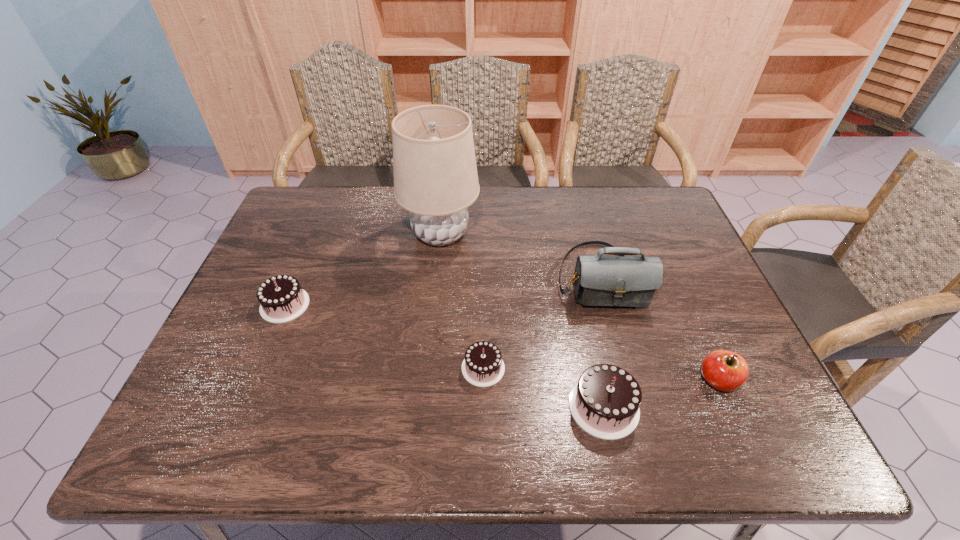
In the image, there is a desktop. Identify the location of blank space at the left edge. The height and width of the screenshot is (540, 960). (286, 272).

The image size is (960, 540). In order to click on free space at the right edge of the desktop in this screenshot , I will do `click(658, 241)`.

What are the coordinates of `blank space at the far left corner of the desktop` in the screenshot? It's located at (324, 220).

Where is `vacant space at the near left corner of the desktop`? The height and width of the screenshot is (540, 960). vacant space at the near left corner of the desktop is located at coordinates (203, 384).

The width and height of the screenshot is (960, 540). In the image, there is a desktop. Find the location of `vacant space at the near right corner`. vacant space at the near right corner is located at coordinates (760, 398).

Locate an element on the screen. The width and height of the screenshot is (960, 540). free spot between the second tallest chocolate cake and the shoulder bag is located at coordinates (443, 291).

The image size is (960, 540). I want to click on free space between the farthest chocolate cake and the lampshade, so click(363, 269).

The width and height of the screenshot is (960, 540). I want to click on free space between the third tallest object and the rightmost object, so click(660, 394).

Find the location of a particular element. The image size is (960, 540). free space between the farthest chocolate cake and the shoulder bag is located at coordinates tap(443, 291).

Find the location of a particular element. vacant point located between the lampshade and the leftmost chocolate cake is located at coordinates (363, 269).